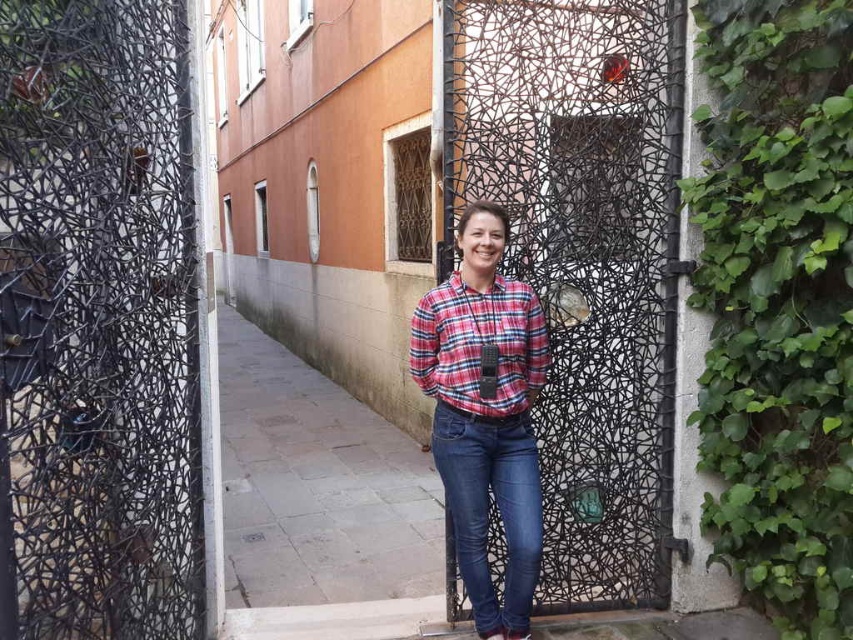
Who is lower down, green leafy ivy at right or plaid cotton shirt at center?

plaid cotton shirt at center is lower down.

Is green leafy ivy at right to the right of plaid cotton shirt at center from the viewer's perspective?

Indeed, green leafy ivy at right is positioned on the right side of plaid cotton shirt at center.

Is point (746, 77) behind point (454, 454)?

Yes.

Locate an element on the screen. green leafy ivy at right is located at coordinates (776, 304).

Is green leafy ivy at right positioned in front of denim jeans at center?

That is True.

Consider the image. Who is more distant from viewer, (740, 29) or (508, 605)?

The point (508, 605) is behind.

You are a GUI agent. You are given a task and a screenshot of the screen. Output one action in this format:
    pyautogui.click(x=<x>, y=<y>)
    Task: Click on the green leafy ivy at right
    
    Given the screenshot: What is the action you would take?
    pyautogui.click(x=776, y=304)

Can you confirm if plaid cotton shirt at center is smaller than denim jeans at center?

Incorrect, plaid cotton shirt at center is not smaller in size than denim jeans at center.

Is point (469, 582) farther from viewer compared to point (466, 516)?

Yes, it is.

Between point (497, 502) and point (534, 584), which one is positioned behind?

The point (497, 502) is behind.

Locate an element on the screen. The width and height of the screenshot is (853, 640). plaid cotton shirt at center is located at coordinates (485, 413).